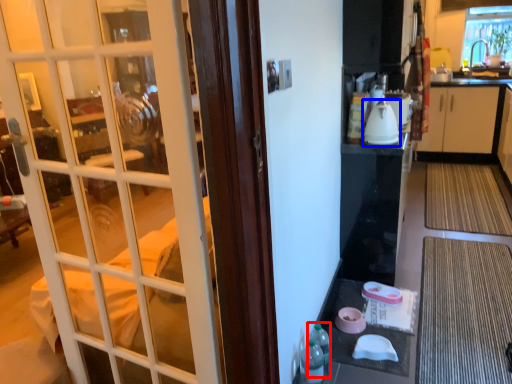
Question: Which point is closer to the camera, bottle (highlighted by a red box) or kitchen appliance (highlighted by a blue box)?

Choices:
 (A) bottle
 (B) kitchen appliance

Answer: (A)